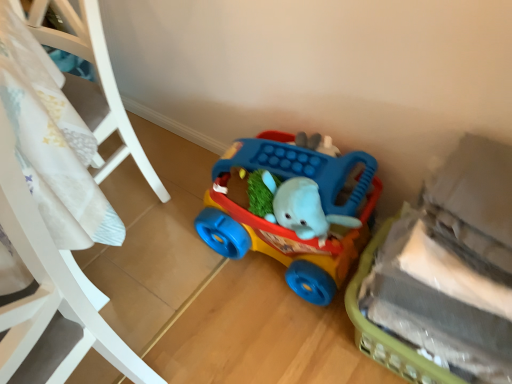
Question: Is rubberized plastic walker at center, which is the 2th toy in front-to-back order, to the left or to the right of white plastic crib at left in the image?

Choices:
 (A) right
 (B) left

Answer: (A)

Question: From the image's perspective, is rubberized plastic walker at center, which is the 2th toy in front-to-back order, positioned above or below white plastic crib at left?

Choices:
 (A) above
 (B) below

Answer: (B)

Question: Based on their relative distances, which object is farther from the rubberized plastic walker at center, which is the 2th toy in front-to-back order?

Choices:
 (A) white plastic crib at left
 (B) plush gray elephant at lower right, marked as the first toy in a front-to-back arrangement

Answer: (A)

Question: Based on their relative distances, which object is nearer to the plush gray elephant at lower right, marked as the first toy in a front-to-back arrangement?

Choices:
 (A) white plastic crib at left
 (B) rubberized plastic walker at center, the first toy when ordered from back to front

Answer: (B)